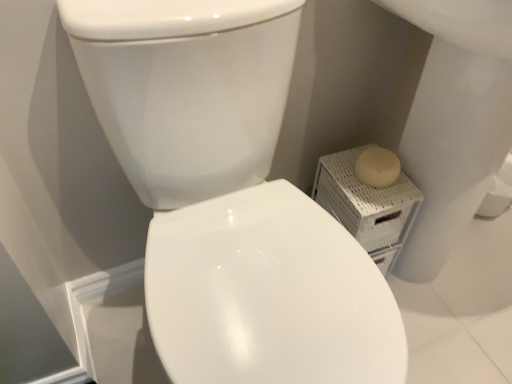
Question: Considering the relative positions of white glossy bidet at center and beige wicker basket at right in the image provided, is white glossy bidet at center to the right of beige wicker basket at right from the viewer's perspective?

Choices:
 (A) no
 (B) yes

Answer: (B)

Question: Is beige wicker basket at right surrounded by white glossy bidet at center?

Choices:
 (A) yes
 (B) no

Answer: (B)

Question: From a real-world perspective, is white glossy bidet at center physically below beige wicker basket at right?

Choices:
 (A) no
 (B) yes

Answer: (B)

Question: Considering the relative positions of white glossy bidet at center and beige wicker basket at right in the image provided, is white glossy bidet at center to the left of beige wicker basket at right from the viewer's perspective?

Choices:
 (A) no
 (B) yes

Answer: (A)

Question: Considering the relative sizes of white glossy bidet at center and beige wicker basket at right in the image provided, is white glossy bidet at center smaller than beige wicker basket at right?

Choices:
 (A) yes
 (B) no

Answer: (B)

Question: From the image's perspective, is white glossy bidet at center on beige wicker basket at right?

Choices:
 (A) yes
 (B) no

Answer: (B)

Question: Can you confirm if white glossy bidet at center is thinner than white glossy toilet at center?

Choices:
 (A) yes
 (B) no

Answer: (B)

Question: From a real-world perspective, is white glossy bidet at center below white glossy toilet at center?

Choices:
 (A) no
 (B) yes

Answer: (B)

Question: Does white glossy bidet at center appear on the right side of white glossy toilet at center?

Choices:
 (A) yes
 (B) no

Answer: (A)

Question: Is white glossy bidet at center wider than white glossy toilet at center?

Choices:
 (A) no
 (B) yes

Answer: (B)

Question: Does white glossy bidet at center have a smaller size compared to white glossy toilet at center?

Choices:
 (A) no
 (B) yes

Answer: (B)

Question: From the image's perspective, is white glossy bidet at center beneath white glossy toilet at center?

Choices:
 (A) no
 (B) yes

Answer: (B)

Question: Is beige wicker basket at right turned away from white glossy bidet at center?

Choices:
 (A) yes
 (B) no

Answer: (B)